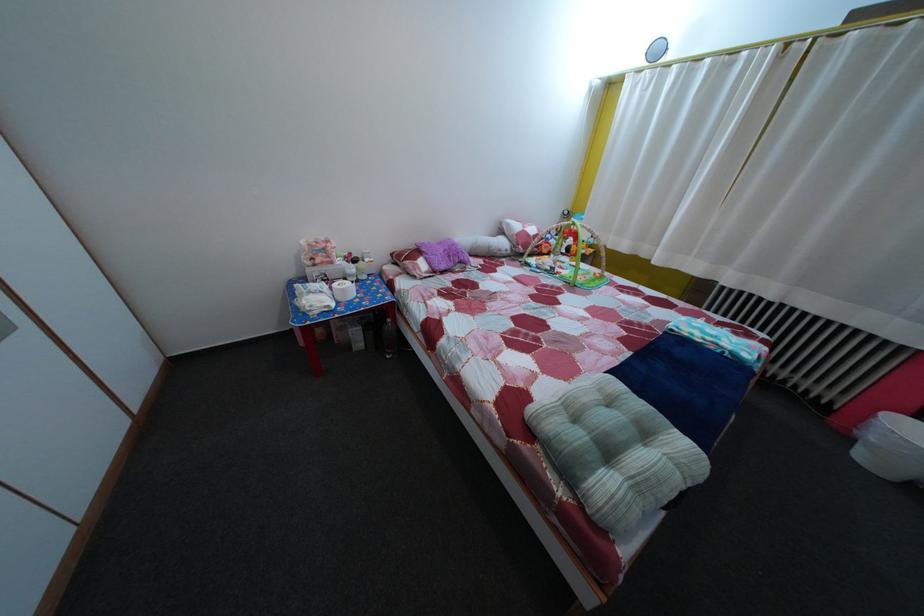
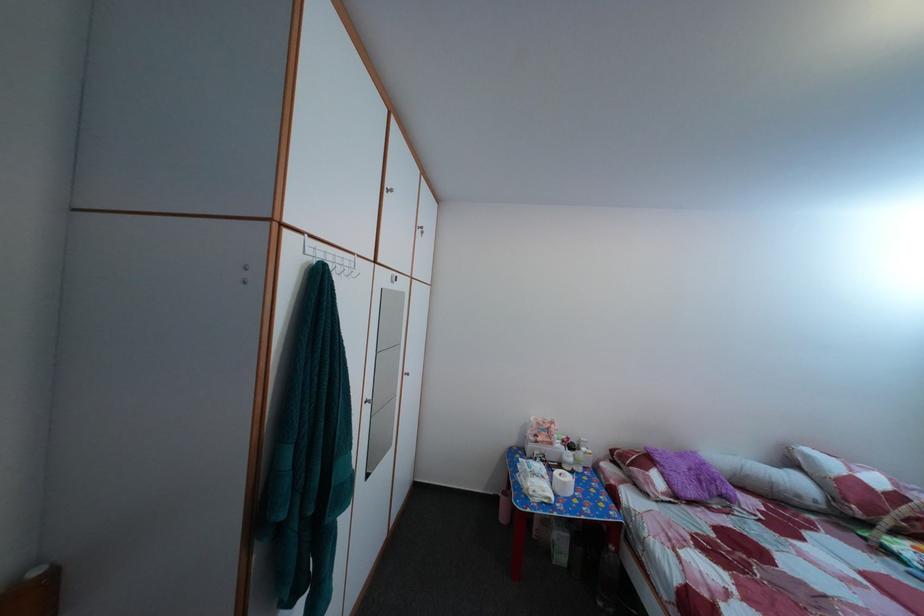
Find the pixel in the second image that matches point 359,262 in the first image.

(578, 447)